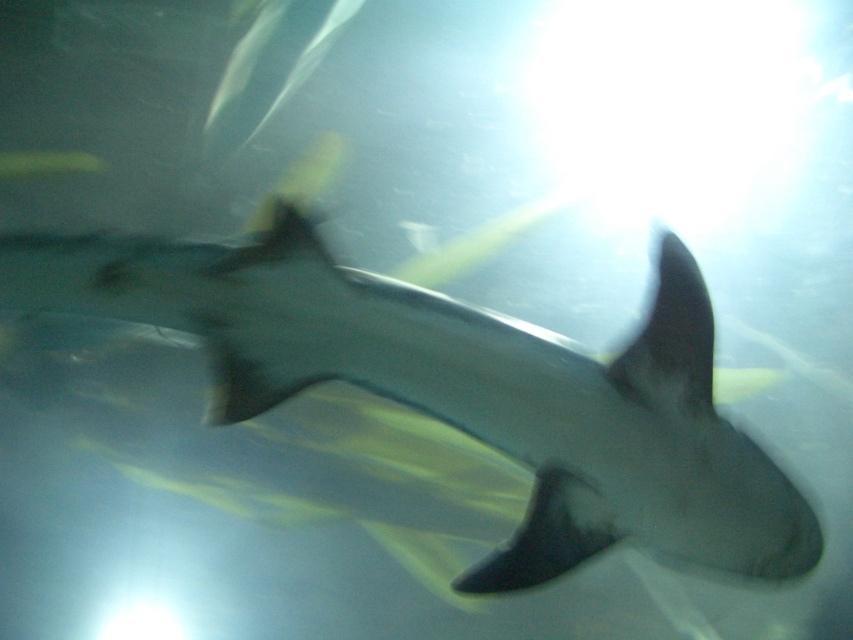
Question: Does gray matte shark at center appear under black matte fin at upper center?

Choices:
 (A) no
 (B) yes

Answer: (B)

Question: Is gray matte shark at center in front of black matte fin at upper center?

Choices:
 (A) no
 (B) yes

Answer: (B)

Question: Which point is closer to the camera?

Choices:
 (A) (630, 385)
 (B) (679, 348)

Answer: (A)

Question: Is gray matte shark at center further to camera compared to black matte fin at upper center?

Choices:
 (A) yes
 (B) no

Answer: (B)

Question: Which of the following is the closest to the observer?

Choices:
 (A) (688, 266)
 (B) (695, 525)

Answer: (A)